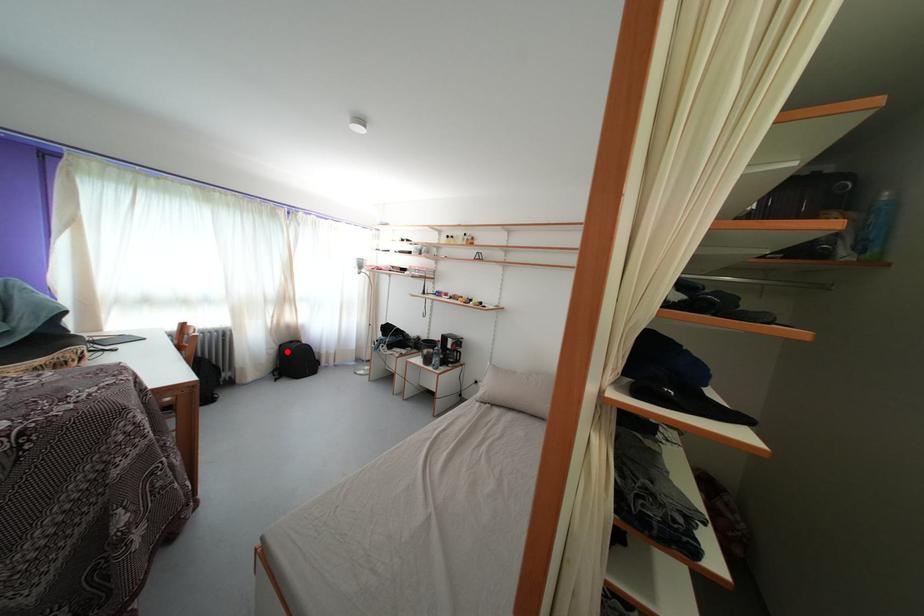
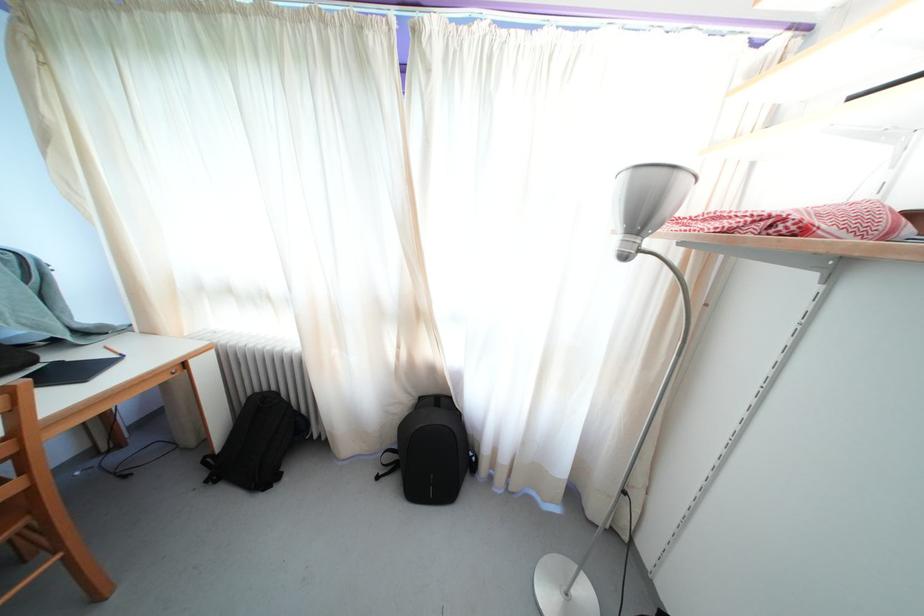
The point at the highlighted location is marked in the first image. Where is the corresponding point in the second image?

(427, 405)